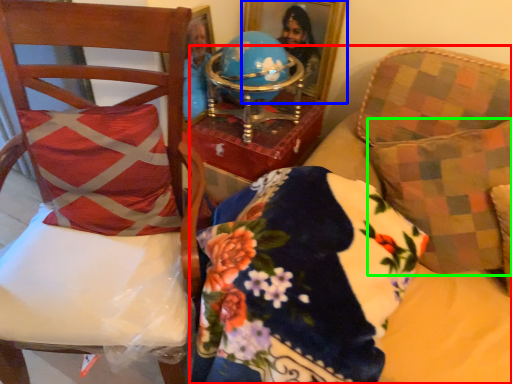
Question: Estimate the real-world distances between objects in this image. Which object is farther from furniture (highlighted by a red box), picture frame (highlighted by a blue box) or throw pillow (highlighted by a green box)?

Choices:
 (A) picture frame
 (B) throw pillow

Answer: (A)